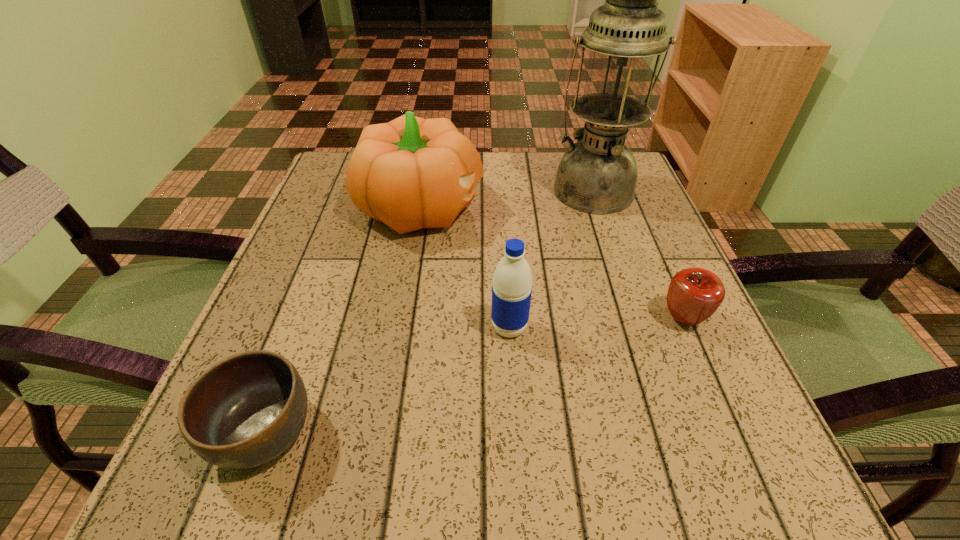
Find the location of `object that is at the far right corner`. object that is at the far right corner is located at coordinates (598, 174).

Where is `free spot at the near edge of the desktop`? The image size is (960, 540). free spot at the near edge of the desktop is located at coordinates (422, 446).

You are a GUI agent. You are given a task and a screenshot of the screen. Output one action in this format:
    pyautogui.click(x=<x>, y=<y>)
    Task: Click on the vacant space at the right edge
    
    Given the screenshot: What is the action you would take?
    pyautogui.click(x=615, y=258)

Find the location of a particular element. free space between the oil lamp and the pumpkin is located at coordinates (507, 198).

Locate an element on the screen. This screenshot has width=960, height=540. free point between the third shortest object and the apple is located at coordinates 596,323.

In order to click on vacant area that lies between the pumpkin and the oil lamp in this screenshot , I will do `click(507, 198)`.

At what (x,y) coordinates should I click in order to perform the action: click on blank region between the pumpkin and the apple. Please return your answer as a coordinate pair (x, y). The height and width of the screenshot is (540, 960). Looking at the image, I should click on (553, 263).

Where is `empty space between the pumpkin and the nearest object`? This screenshot has width=960, height=540. empty space between the pumpkin and the nearest object is located at coordinates (343, 320).

The height and width of the screenshot is (540, 960). Identify the location of empty space that is in between the bowl and the tallest object. (428, 311).

Find the location of `free point between the oil lamp and the pumpkin`. free point between the oil lamp and the pumpkin is located at coordinates (507, 198).